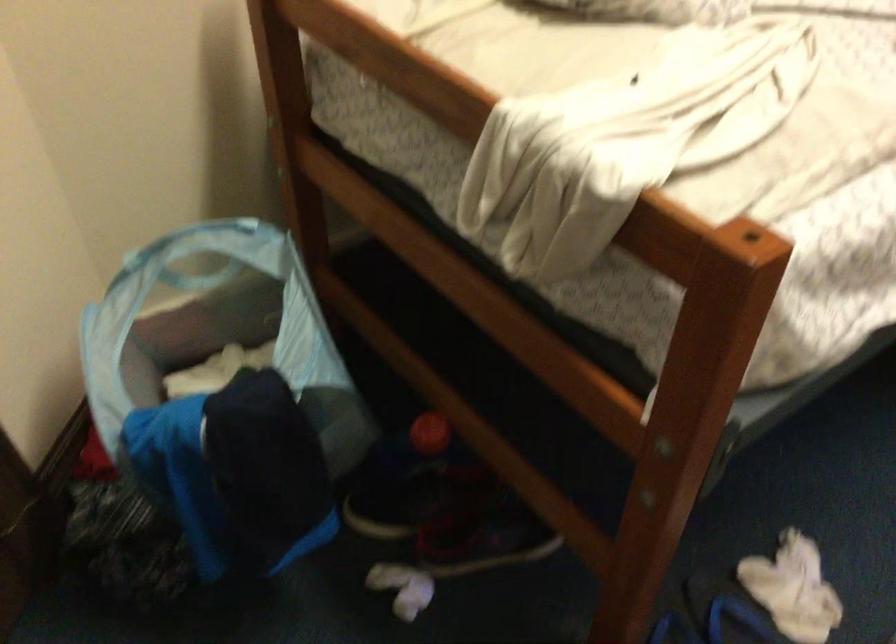
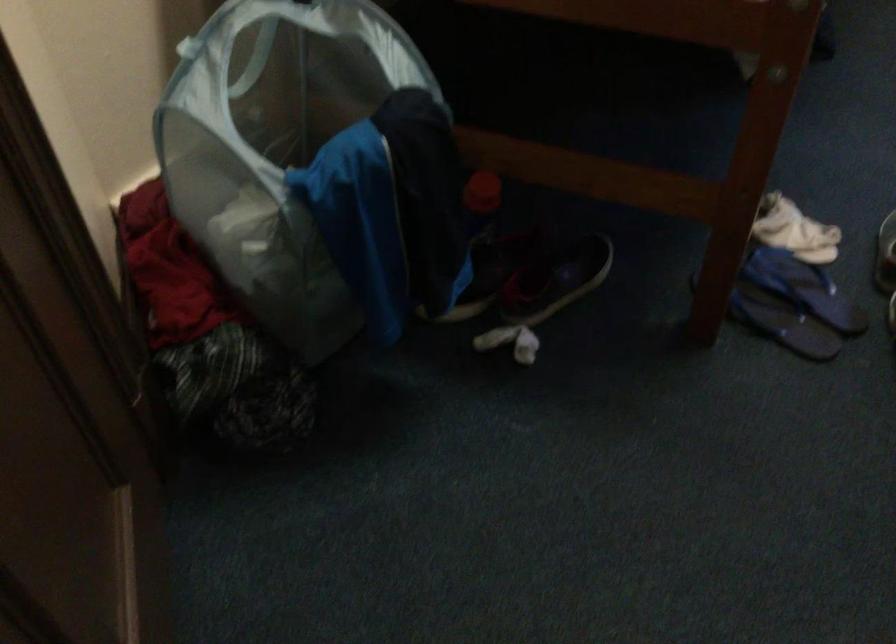
Locate, in the second image, the point that corresponds to [477,547] in the first image.

(556, 279)